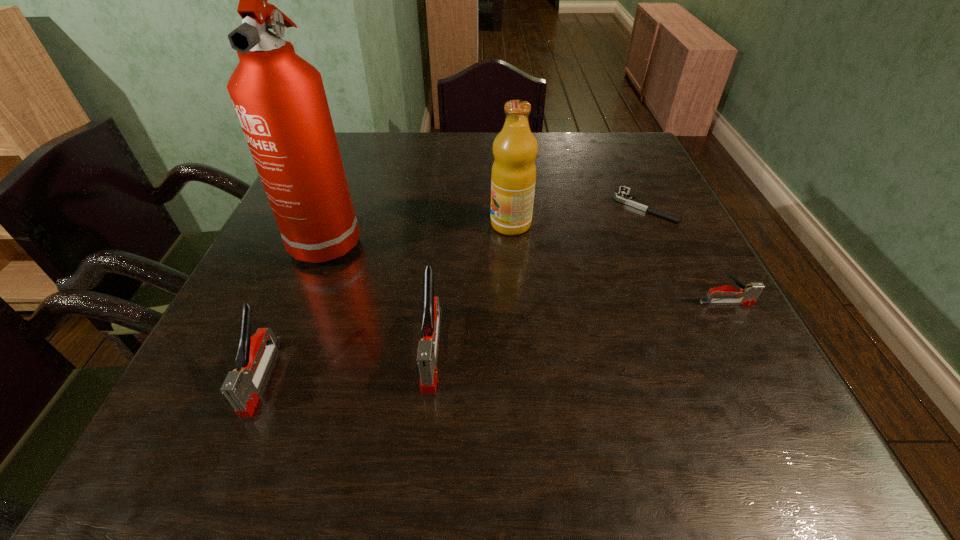
Where is `free point between the fourth object from right to left and the farthest stapler`? This screenshot has height=540, width=960. free point between the fourth object from right to left and the farthest stapler is located at coordinates (580, 326).

Locate an element on the screen. The width and height of the screenshot is (960, 540). vacant region between the farthest stapler and the fire extinguisher is located at coordinates (528, 269).

This screenshot has height=540, width=960. Identify the location of vacant area that lies between the shortest stapler and the fire extinguisher. (528, 269).

Where is `empty space that is in between the fifth shortest object and the third nearest object`? empty space that is in between the fifth shortest object and the third nearest object is located at coordinates (618, 264).

At what (x,y) coordinates should I click in order to perform the action: click on free space between the shortest stapler and the fourth object from right to left. Please return your answer as a coordinate pair (x, y). Image resolution: width=960 pixels, height=540 pixels. Looking at the image, I should click on (580, 326).

The width and height of the screenshot is (960, 540). Find the location of `object that ranks as the closest to the second tallest stapler`. object that ranks as the closest to the second tallest stapler is located at coordinates (279, 98).

Identify the location of object that can be found as the second closest to the leftmost stapler. This screenshot has width=960, height=540. (427, 350).

Image resolution: width=960 pixels, height=540 pixels. In order to click on stapler that stands as the closest to the second tallest stapler in this screenshot , I will do point(427,350).

At what (x,y) coordinates should I click in order to perform the action: click on stapler object that ranks as the closest to the third object from right to left. Please return your answer as a coordinate pair (x, y). The width and height of the screenshot is (960, 540). Looking at the image, I should click on (427, 350).

The image size is (960, 540). What are the coordinates of `vacant area in the image that satisfies the following two spatial constraints: 1. on the front label of the fruit juice; 2. on the handle side of the fourth tallest object` in the screenshot? It's located at (523, 376).